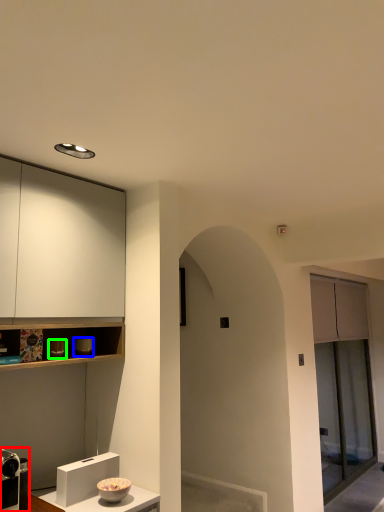
Question: Considering the real-world distances, which object is farthest from appliance (highlighted by a red box)? appliance (highlighted by a blue box) or appliance (highlighted by a green box)?

Choices:
 (A) appliance
 (B) appliance

Answer: (A)